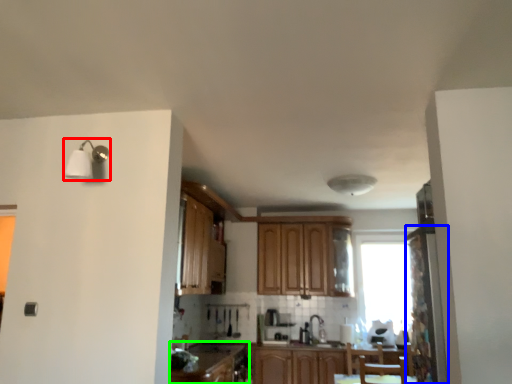
Question: Which is nearer to the light fixture (highlighted by a red box)? screen door (highlighted by a blue box) or cabinetry (highlighted by a green box).

Choices:
 (A) screen door
 (B) cabinetry

Answer: (B)